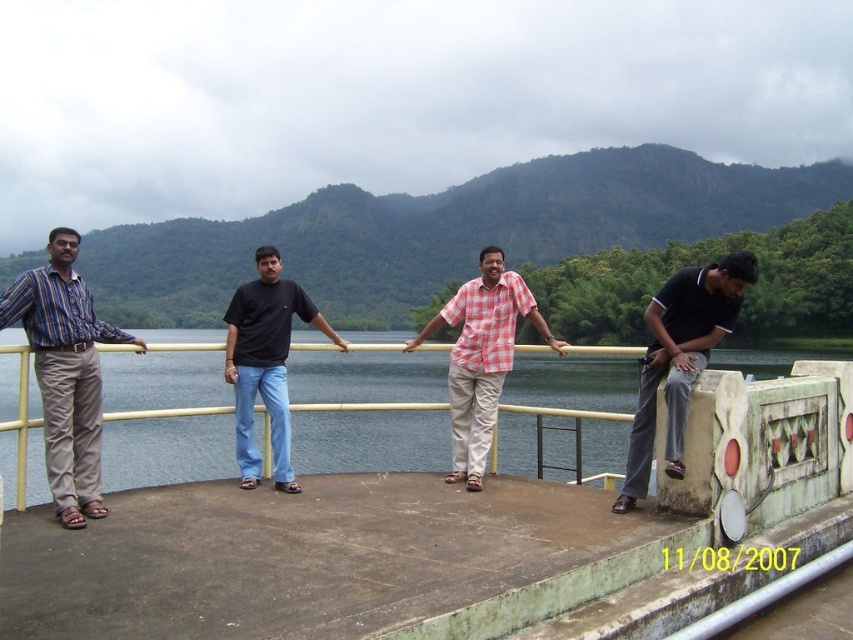
Question: Is the position of striped cotton shirt at left less distant than that of gray fabric pants at right?

Choices:
 (A) yes
 (B) no

Answer: (A)

Question: Which of these objects is positioned farthest from the checkered fabric shirt at center?

Choices:
 (A) clear water at center
 (B) striped cotton shirt at left
 (C) black cotton shirt at center
 (D) gray fabric pants at right

Answer: (A)

Question: Which point is closer to the camera?

Choices:
 (A) (323, 440)
 (B) (654, 323)

Answer: (B)

Question: Does gray fabric pants at right have a larger size compared to checkered fabric shirt at center?

Choices:
 (A) no
 (B) yes

Answer: (B)

Question: Considering the real-world distances, which object is farthest from the black cotton shirt at center?

Choices:
 (A) clear water at center
 (B) striped cotton shirt at left
 (C) gray fabric pants at right
 (D) checkered fabric shirt at center

Answer: (A)

Question: Considering the relative positions of gray fabric pants at right and checkered fabric shirt at center in the image provided, where is gray fabric pants at right located with respect to checkered fabric shirt at center?

Choices:
 (A) below
 (B) above

Answer: (A)